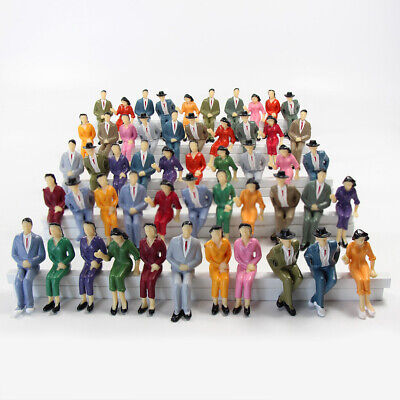
Identify the location of bench. Image resolution: width=400 pixels, height=400 pixels. (261, 288), (261, 222), (265, 181), (236, 147), (215, 125).